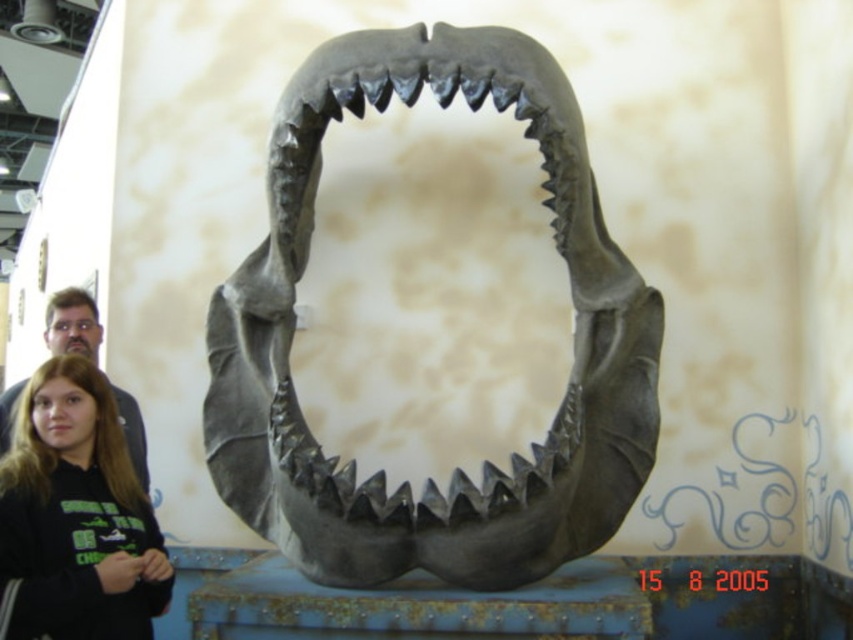
Question: Which point is closer to the camera?

Choices:
 (A) (39, 429)
 (B) (51, 323)
 (C) (607, 342)
 (D) (48, 516)

Answer: (D)

Question: Is gray metallic shark jaw at center bigger than black hoodie at lower left?

Choices:
 (A) yes
 (B) no

Answer: (A)

Question: Which point appears closest to the camera in this image?

Choices:
 (A) (62, 429)
 (B) (477, 100)

Answer: (B)

Question: Does black hoodie at lower left appear under matte black hair at lower left?

Choices:
 (A) yes
 (B) no

Answer: (A)

Question: Which object appears farthest from the camera in this image?

Choices:
 (A) black hoodie at lower left
 (B) matte gray teeth at center

Answer: (B)

Question: Is black hoodie at lower left thinner than matte black hair at lower left?

Choices:
 (A) no
 (B) yes

Answer: (B)